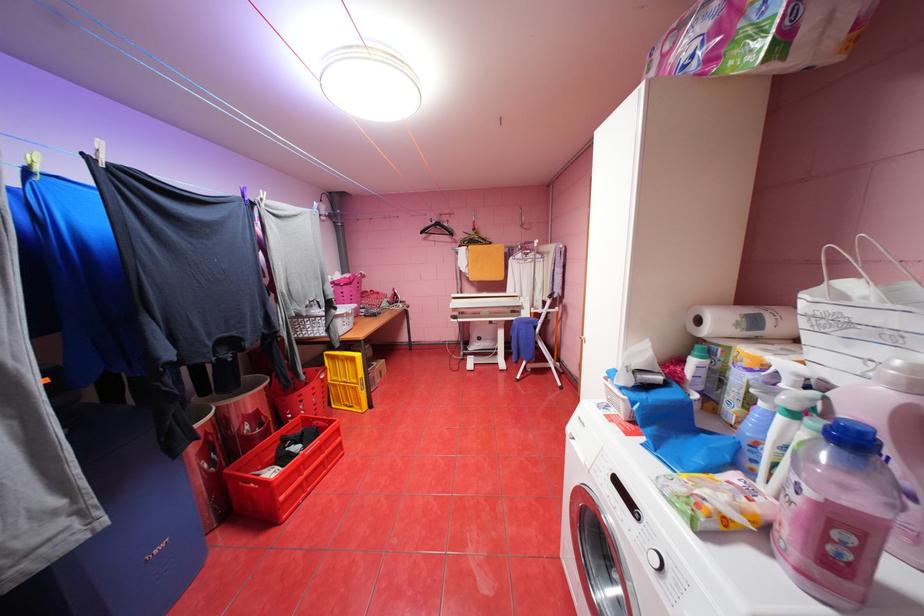
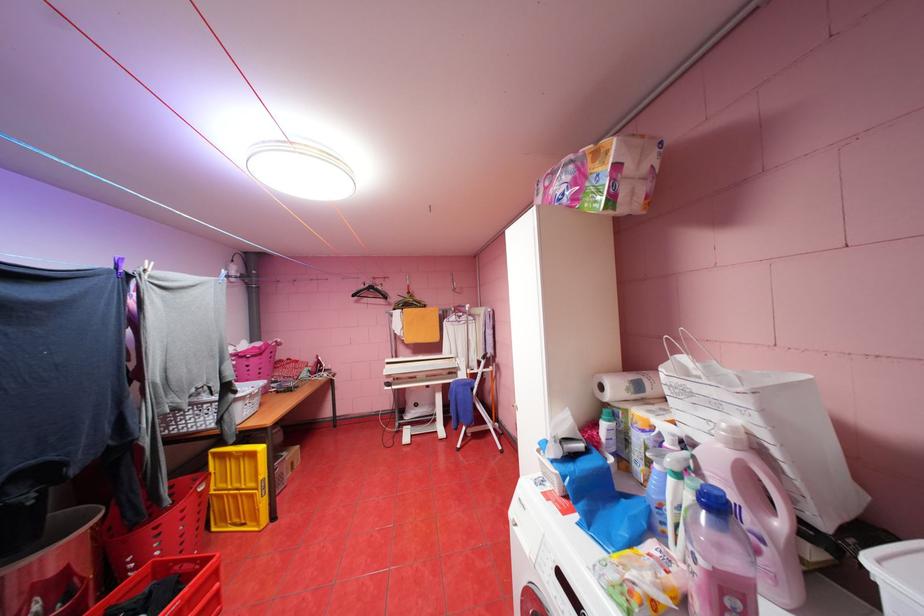
The point at (431,232) is marked in the first image. Where is the corresponding point in the second image?

(361, 294)